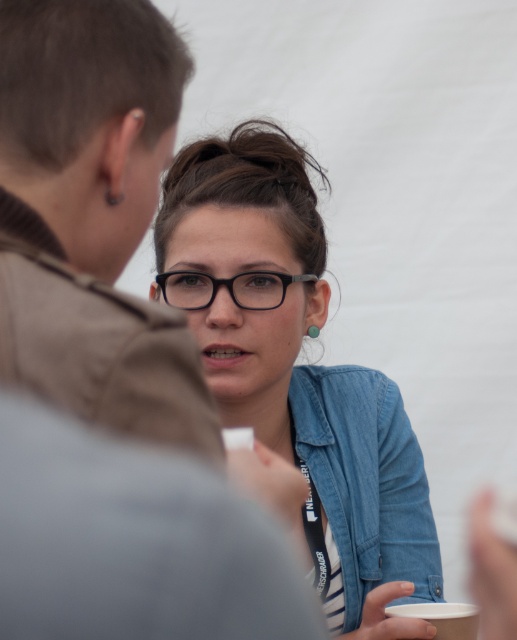
Is black plastic glasses at center wider than white paper cup at lower right?

Indeed, black plastic glasses at center has a greater width compared to white paper cup at lower right.

Consider the image. Which of these two, black plastic glasses at center or white paper cup at lower right, stands shorter?

white paper cup at lower right is shorter.

Is point (260, 284) positioned before point (464, 611)?

No, it is not.

This screenshot has width=517, height=640. Identify the location of black plastic glasses at center. (227, 289).

Does matte black glasses at center appear on the right side of denim jacket at lower right?

No, matte black glasses at center is not to the right of denim jacket at lower right.

Is matte black glasses at center smaller than denim jacket at lower right?

No, matte black glasses at center is not smaller than denim jacket at lower right.

You are a GUI agent. You are given a task and a screenshot of the screen. Output one action in this format:
    pyautogui.click(x=<x>, y=<y>)
    Task: Click on the matte black glasses at center
    Image resolution: width=517 pixels, height=640 pixels.
    Given the screenshot: What is the action you would take?
    pyautogui.click(x=301, y=376)

Between matte black glasses at center and black plastic glasses at center, which one appears on the left side from the viewer's perspective?

black plastic glasses at center

Does matte black glasses at center have a greater height compared to black plastic glasses at center?

Correct, matte black glasses at center is much taller as black plastic glasses at center.

Is point (252, 424) positioned in front of point (271, 294)?

That is False.

Locate an element on the screen. matte black glasses at center is located at coordinates (301, 376).